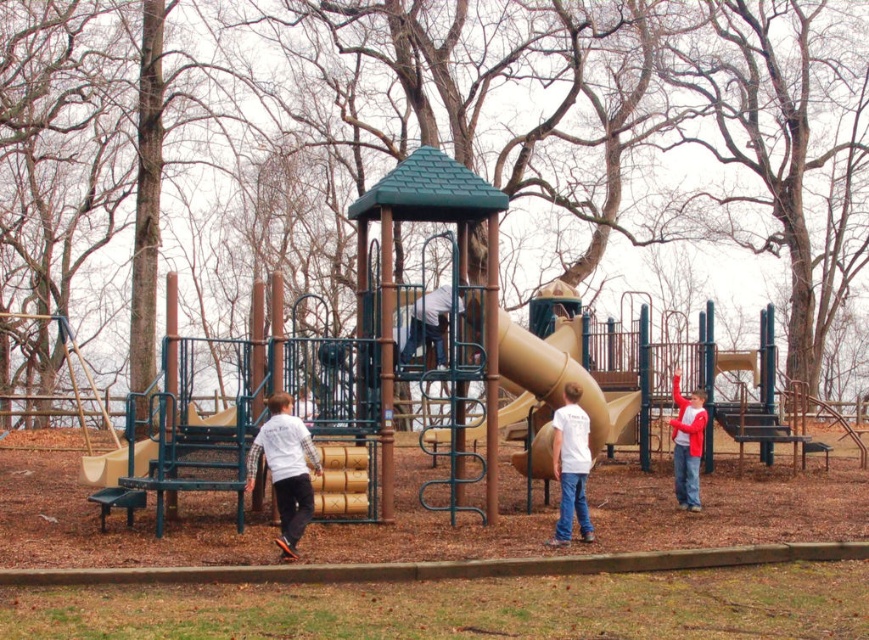
You are standing at the point with coordinates point [91,470] and want to reach the point [310,488]. Which direction should you move to get there?

To reach point [310,488] from point [91,470], you should move forward since point [310,488] is in front of point [91,470].

You are a parent watching your child play in the playground. Your child is wearing light blue jeans at center and is standing near the beige rubber slide at center. You want to ensure they are safe. Based on the image, is your child standing on top of the slide or below it?

The beige rubber slide at center is positioned under light blue jeans at center, so the child wearing light blue jeans at center is standing above the slide.

You are a parent trying to locate your child in the playground. You see two points marked in the image. Which point is closer to the camera, point (692, 490) or point (459, 308)?

Point (459, 308) is closer to the camera than point (692, 490) because the description states that point (692, 490) is further away.